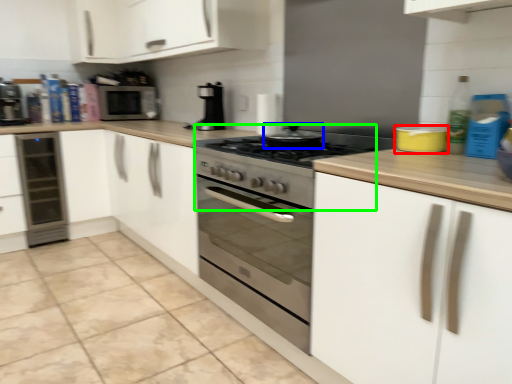
Question: Which object is positioned farthest from appliance (highlighted by a red box)? Select from appliance (highlighted by a blue box) and gas stove (highlighted by a green box).

Choices:
 (A) appliance
 (B) gas stove

Answer: (B)